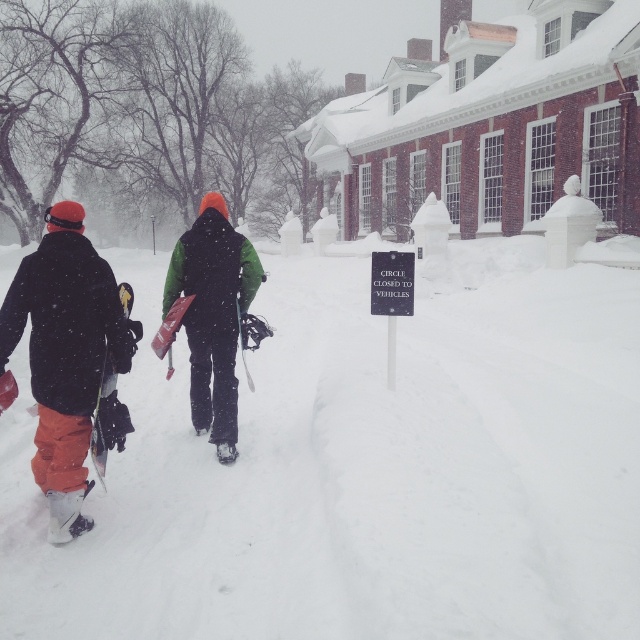
Question: Observing the image, what is the correct spatial positioning of white fluffy snow at center in reference to green fabric jacket at center?

Choices:
 (A) below
 (B) above

Answer: (B)

Question: Estimate the real-world distances between objects in this image. Which object is farther from the white rubber snowshoe at lower center?

Choices:
 (A) matte black ski at left
 (B) white matte snowshoe at lower left

Answer: (B)

Question: Which of the following is the closest to the observer?

Choices:
 (A) (234, 448)
 (B) (202, 582)
 (C) (49, 529)
 (D) (68, 429)

Answer: (B)

Question: Which object appears farthest from the camera in this image?

Choices:
 (A) white matte snowshoe at lower left
 (B) white rubber snowshoe at lower center
 (C) white fluffy snow at center
 (D) matte black snowboard at left

Answer: (B)

Question: Where is matte black ski at left located in relation to white rubber snowshoe at lower center in the image?

Choices:
 (A) right
 (B) left

Answer: (B)

Question: Is matte black snowboard at left positioned in front of green fabric jacket at center?

Choices:
 (A) no
 (B) yes

Answer: (B)